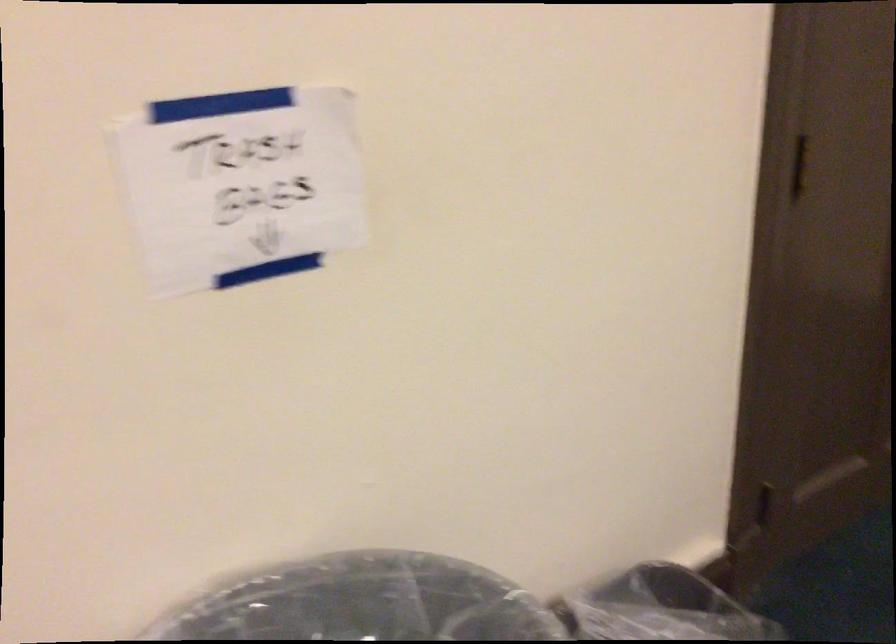
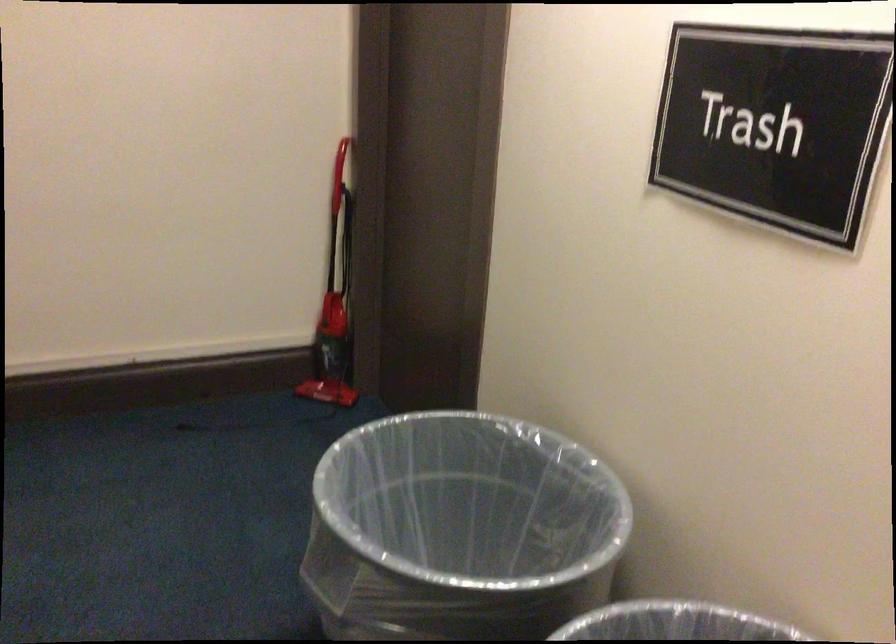
Question: How did the camera likely rotate?

Choices:
 (A) Left
 (B) Right
 (C) Up
 (D) Down

Answer: (B)